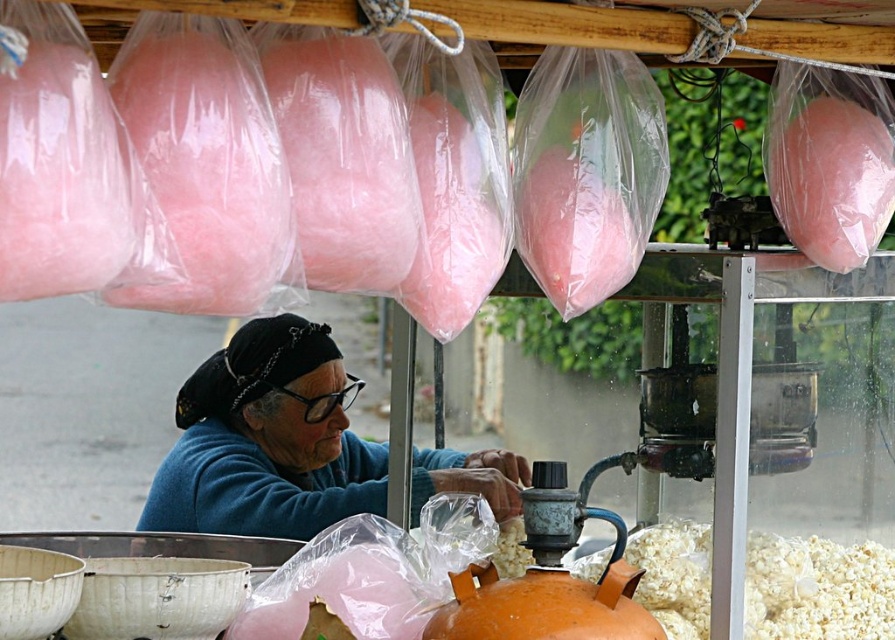
You are a customer standing in front of the cotton candy stall. You notice the blue fabric at center. Based on its position, can you determine if it is closer to the front or the back of the stall?

The blue fabric at center is located at point coordinates that place it closer to the front of the stall since its y coordinate is 0.299, which is lower than the center point of the image. In image coordinate systems, lower y values typically indicate positions closer to the bottom, which in this context would be the front of the stall.

You are a customer at the cotton candy stall. You see the white fluffy popcorn at lower right and the pink cotton candy at upper right. Which item is closer to you?

The white fluffy popcorn at lower right is closer to you because the pink cotton candy at upper right is behind it.

You are a customer at the cotton candy stall and want to know which item is wider between the white fluffy popcorn at lower right and the pink cotton candy at upper right. Can you tell me?

The white fluffy popcorn at lower right is wider than the pink cotton candy at upper right according to the description.